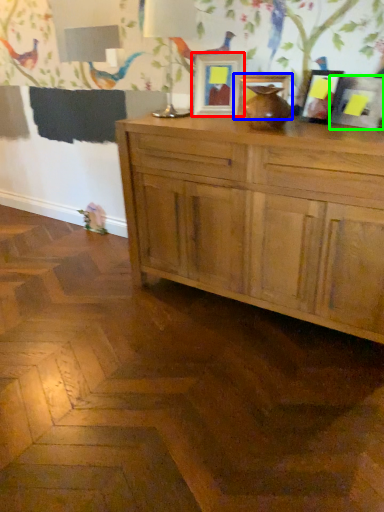
Question: Estimate the real-world distances between objects in this image. Which object is farther from picture frame (highlighted by a red box), picture frame (highlighted by a blue box) or picture frame (highlighted by a green box)?

Choices:
 (A) picture frame
 (B) picture frame

Answer: (B)